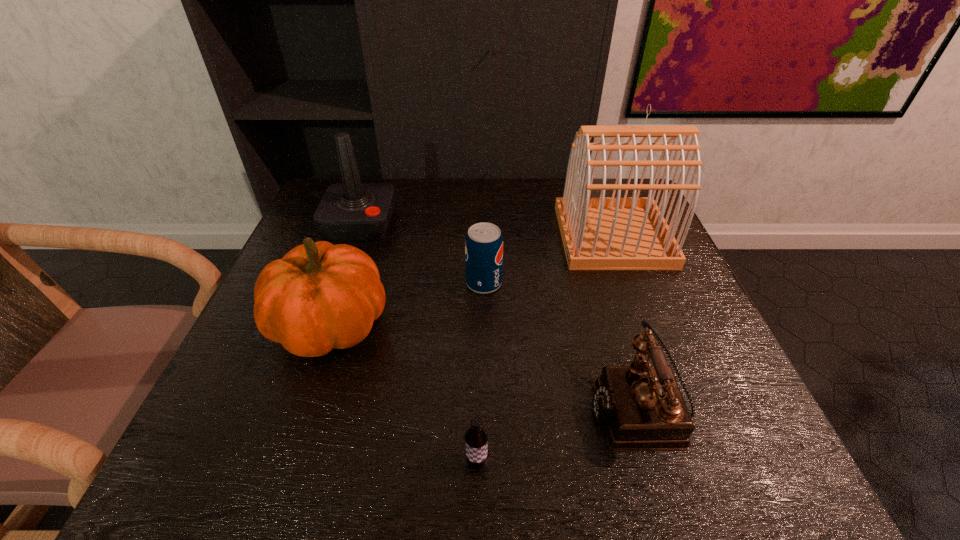
In the image, there is a desktop. At what (x,y) coordinates should I click in order to perform the action: click on free space at the far left corner. Please return your answer as a coordinate pair (x, y). This screenshot has height=540, width=960. Looking at the image, I should click on (335, 183).

This screenshot has width=960, height=540. I want to click on free spot between the birdcage and the telephone, so click(627, 321).

Find the location of a particular element. This screenshot has width=960, height=540. empty location between the pop and the shortest object is located at coordinates click(x=480, y=374).

This screenshot has width=960, height=540. I want to click on free area in between the joystick and the shortest object, so click(x=419, y=343).

At what (x,y) coordinates should I click in order to perform the action: click on free space between the shortest object and the birdcage. Please return your answer as a coordinate pair (x, y). The height and width of the screenshot is (540, 960). Looking at the image, I should click on (545, 350).

Where is `blank region between the pop and the third tallest object`? blank region between the pop and the third tallest object is located at coordinates (407, 305).

Locate an element on the screen. This screenshot has width=960, height=540. free space between the joystick and the telephone is located at coordinates (501, 315).

The height and width of the screenshot is (540, 960). What are the coordinates of `empty space between the pop and the tallest object` in the screenshot? It's located at (548, 260).

Find the location of a particular element. The width and height of the screenshot is (960, 540). empty location between the shortest object and the pop is located at coordinates (480, 374).

Point out which object is positioned as the third nearest to the pumpkin. Please provide its 2D coordinates. Your answer should be formatted as a tuple, i.e. [(x, y)], where the tuple contains the x and y coordinates of a point satisfying the conditions above.

[(476, 437)]